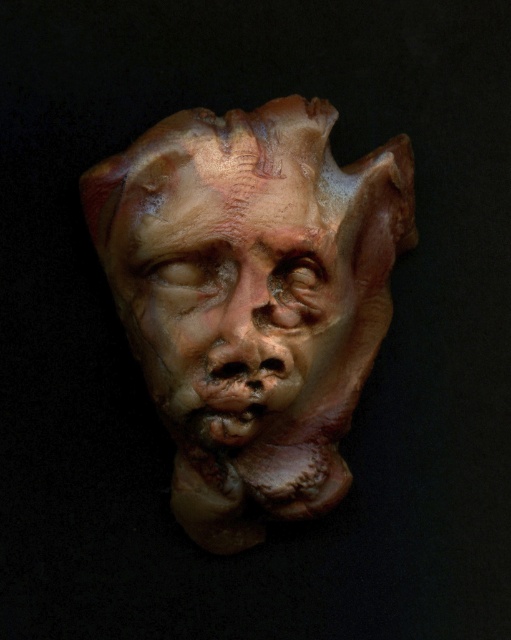
Is matte clay mask at center shorter than matte brown mask at center?

In fact, matte clay mask at center may be taller than matte brown mask at center.

Who is taller, matte clay mask at center or matte brown mask at center?

Standing taller between the two is matte clay mask at center.

Is point (318, 316) behind point (120, 241)?

Yes.

Find the location of `matte clay mask at center`. matte clay mask at center is located at coordinates (251, 300).